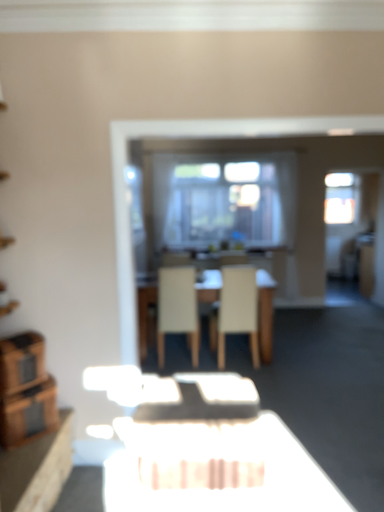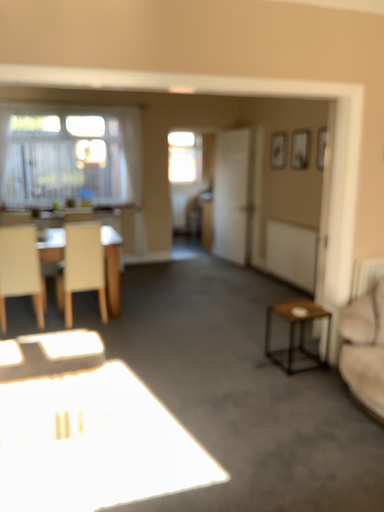
Question: Which way did the camera rotate in the video?

Choices:
 (A) rotated right
 (B) rotated left

Answer: (A)